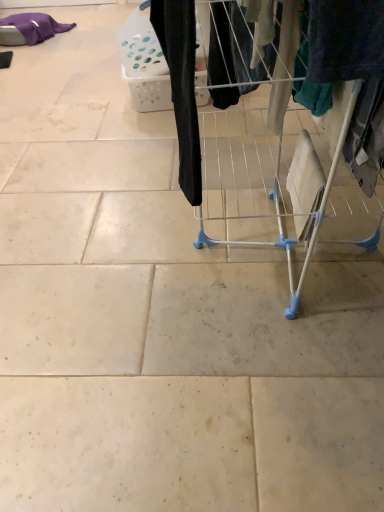
Question: From a real-world perspective, is black fabric pants at center, the first clothing when ordered from bottom to top, positioned above or below purple cotton blanket at upper left, which is counted as the 2th clothing, starting from the front?

Choices:
 (A) above
 (B) below

Answer: (A)

Question: Based on their positions, is black fabric pants at center, acting as the 2th clothing starting from the back, located to the left or right of purple cotton blanket at upper left, placed as the first clothing when sorted from left to right?

Choices:
 (A) right
 (B) left

Answer: (A)

Question: Estimate the real-world distances between objects in this image. Which object is farther from the white wire drying rack at center?

Choices:
 (A) purple cotton blanket at upper left, placed as the first clothing when sorted from left to right
 (B) black fabric pants at center, acting as the 2th clothing starting from the back

Answer: (A)

Question: Which of these objects is positioned farthest from the purple cotton blanket at upper left, which is counted as the 2th clothing, starting from the front?

Choices:
 (A) white wire drying rack at center
 (B) black fabric pants at center, acting as the 2th clothing starting from the back

Answer: (B)